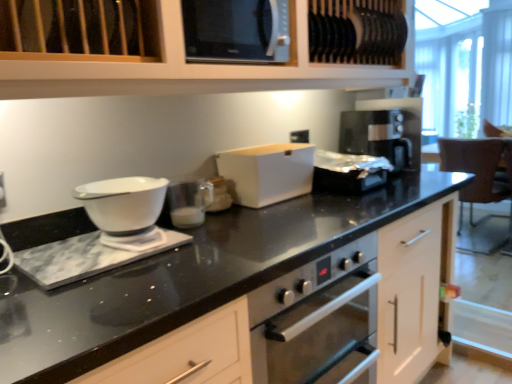
At what (x,y) coordinates should I click in order to perform the action: click on empty space that is to the right of matte glass jar at center, which is counted as the 2th appliance, starting from the back. Please return your answer as a coordinate pair (x, y). Looking at the image, I should click on (253, 213).